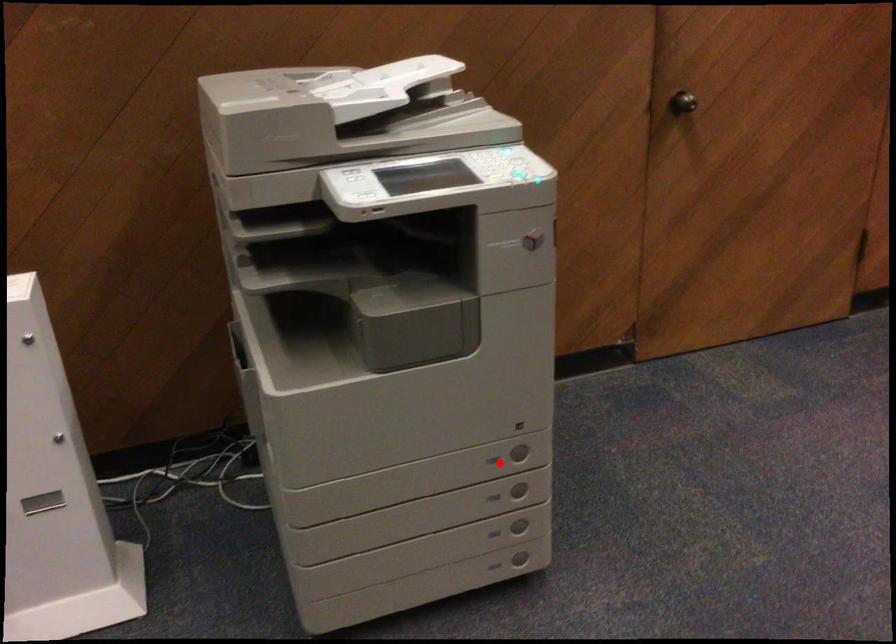
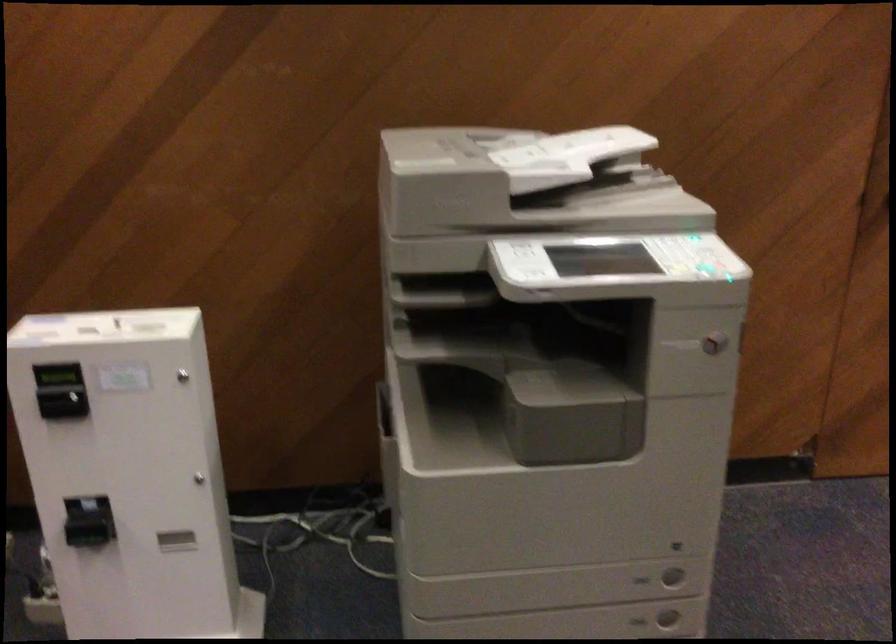
Question: I am providing you with two images of the same scene from different viewpoints. A red point is shown in image1. For the corresponding object point in image2, is it positioned nearer or farther from the camera?

Choices:
 (A) Nearer
 (B) Farther

Answer: (A)